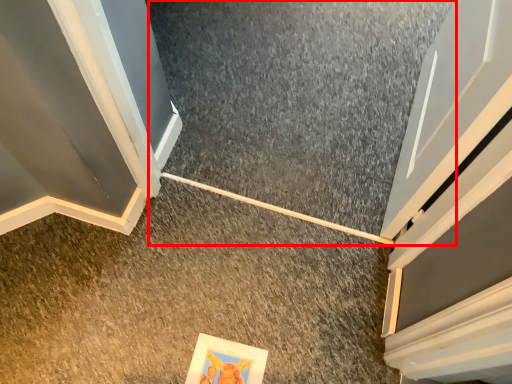
Question: Where is concrete (annotated by the red box) located in relation to concrete in the image?

Choices:
 (A) left
 (B) right

Answer: (B)